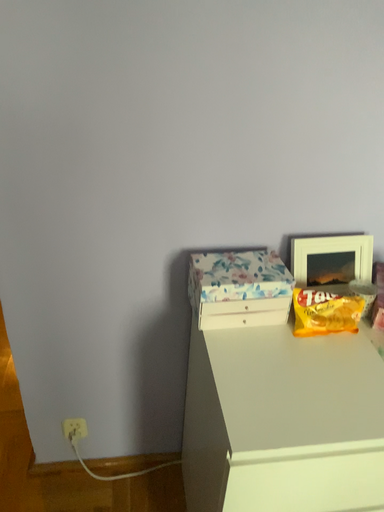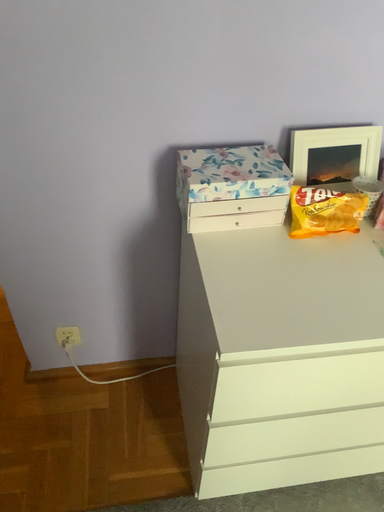
Question: Which way did the camera rotate in the video?

Choices:
 (A) rotated upward
 (B) rotated downward

Answer: (B)